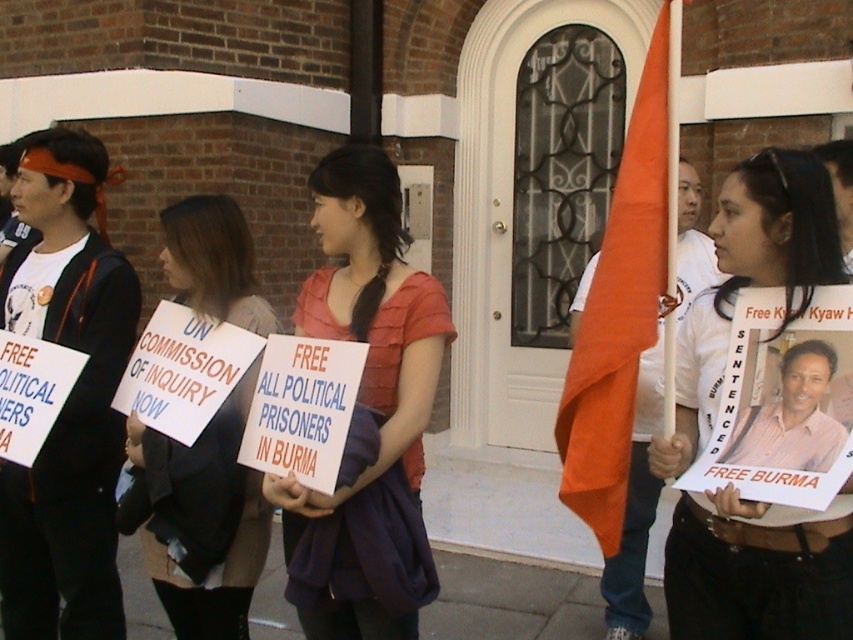
Does matte white shirt at center have a lesser height compared to black fabric sign at center?

Correct, matte white shirt at center is not as tall as black fabric sign at center.

Which of these two, matte white shirt at center or black fabric sign at center, stands shorter?

matte white shirt at center

Is point (801, 541) in front of point (233, 636)?

Yes, point (801, 541) is closer to viewer.

I want to click on matte white shirt at center, so click(757, 570).

Is point (180, 506) positioned in front of point (277, 504)?

No, (180, 506) is behind (277, 504).

In the scene shown: Between black fabric sign at center and matte pink blouse at center, which one is positioned lower?

Positioned lower is black fabric sign at center.

Who is more forward, (202, 550) or (418, 298)?

Point (418, 298)

Locate an element on the screen. Image resolution: width=853 pixels, height=640 pixels. black fabric sign at center is located at coordinates (202, 520).

Between point (769, 604) and point (355, 196), which one is positioned behind?

The point (355, 196) is more distant.

Who is lower down, matte white shirt at center or matte pink blouse at center?

Positioned lower is matte pink blouse at center.

Image resolution: width=853 pixels, height=640 pixels. In order to click on matte white shirt at center in this screenshot , I will do `click(757, 570)`.

This screenshot has height=640, width=853. I want to click on matte white shirt at center, so click(x=757, y=570).